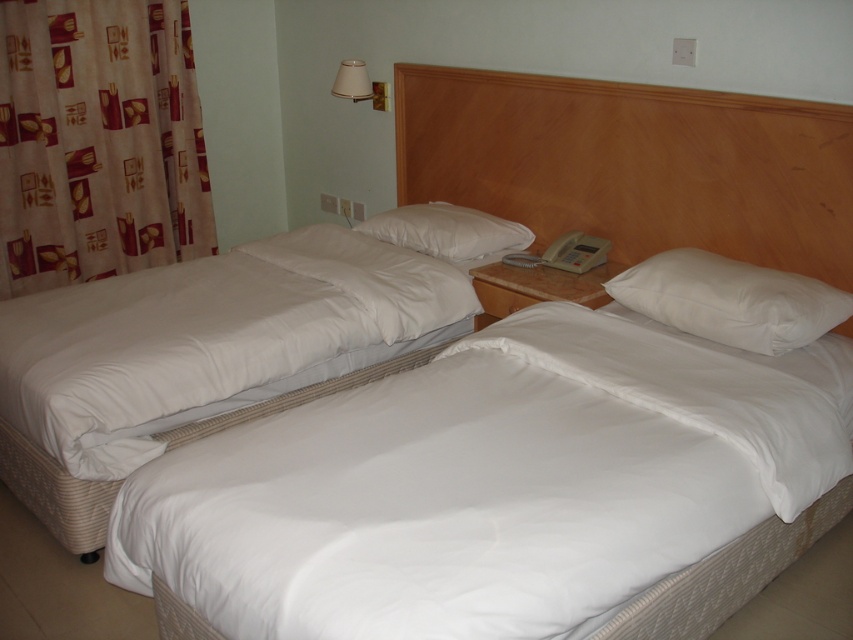
Question: Is the position of beige fabric curtain at left less distant than that of white soft pillow at center?

Choices:
 (A) yes
 (B) no

Answer: (B)

Question: Which point is farther from the camera taking this photo?

Choices:
 (A) (190, 218)
 (B) (747, 342)

Answer: (A)

Question: Is white fabric bed at lower left to the left of white soft pillow at upper right from the viewer's perspective?

Choices:
 (A) yes
 (B) no

Answer: (A)

Question: Is beige fabric curtain at left to the right of white soft pillow at center from the viewer's perspective?

Choices:
 (A) no
 (B) yes

Answer: (A)

Question: Which point is farther to the camera?

Choices:
 (A) wooden headboard at upper center
 (B) beige fabric curtain at left
 (C) white quilted bed at center

Answer: (B)

Question: Which point is farther to the camera?

Choices:
 (A) (549, 83)
 (B) (270, 412)
 (C) (372, 227)
 (D) (338, 90)

Answer: (D)